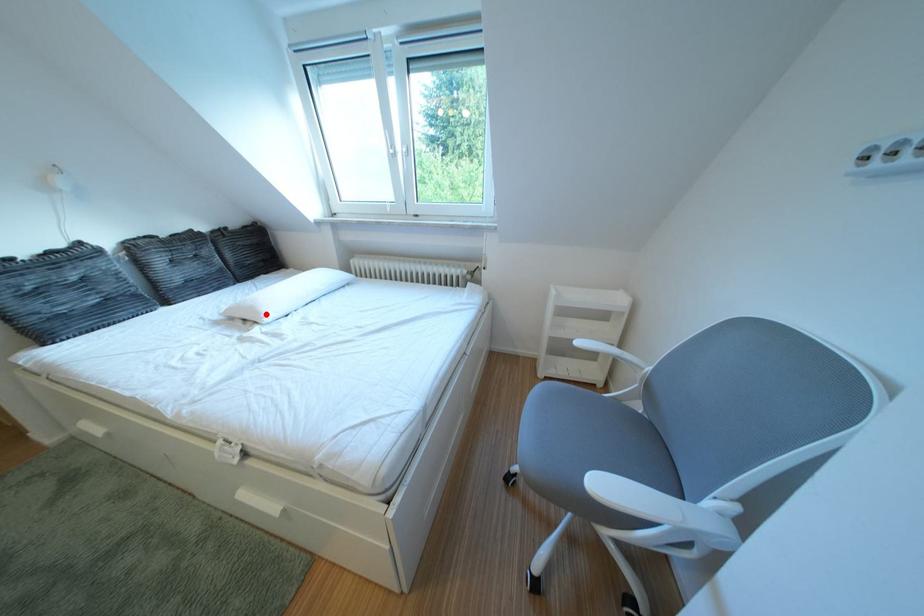
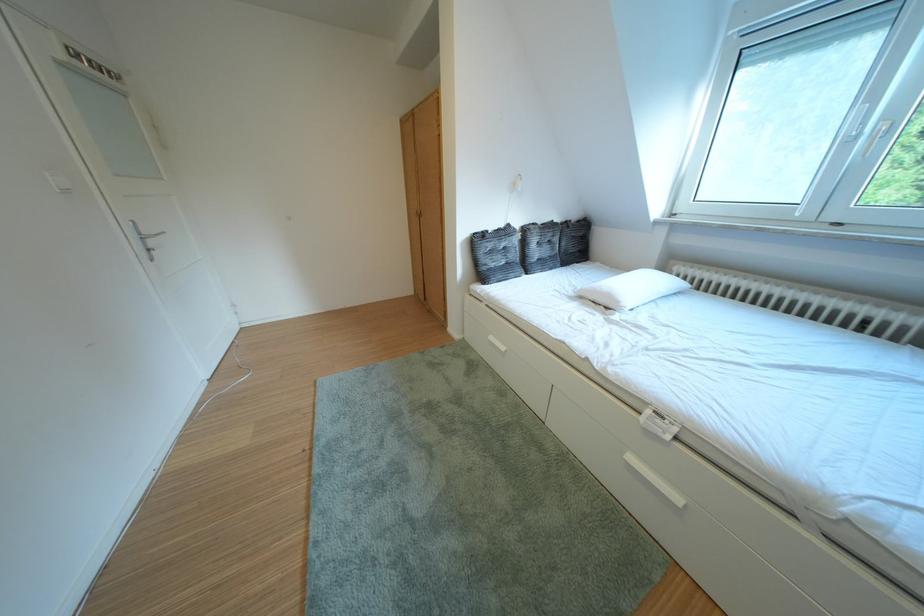
Find the pixel in the second image that matches the highlighted location in the first image.

(623, 301)